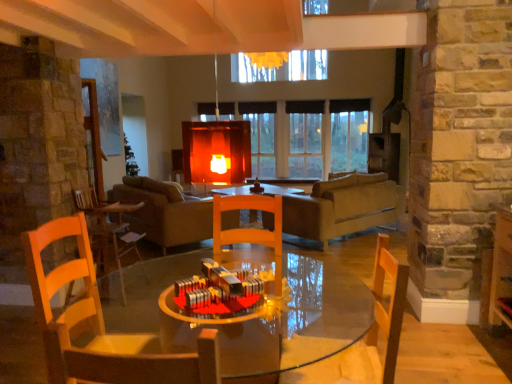
Question: Does wooden chair at center, which ranks as the second chair in right-to-left order, have a larger size compared to leather couch at center?

Choices:
 (A) no
 (B) yes

Answer: (A)

Question: Does wooden chair at center, the third chair in the back-to-front sequence, have a greater height compared to leather couch at center?

Choices:
 (A) yes
 (B) no

Answer: (B)

Question: Is wooden chair at center, positioned as the 1th chair in front-to-back order, positioned far away from leather couch at center?

Choices:
 (A) no
 (B) yes

Answer: (B)

Question: Is wooden chair at center, placed as the second chair when sorted from left to right, wider than leather couch at center?

Choices:
 (A) yes
 (B) no

Answer: (B)

Question: Is wooden chair at center, positioned as the 1th chair in front-to-back order, thinner than leather couch at center?

Choices:
 (A) no
 (B) yes

Answer: (B)

Question: Can leather couch at center be found inside wooden chair at center, which ranks as the second chair in right-to-left order?

Choices:
 (A) no
 (B) yes

Answer: (A)

Question: Is leather couch at center bigger than transparent glass window at center?

Choices:
 (A) no
 (B) yes

Answer: (B)

Question: Is leather couch at center further to camera compared to transparent glass window at center?

Choices:
 (A) no
 (B) yes

Answer: (A)

Question: From a real-world perspective, does leather couch at center stand above transparent glass window at center?

Choices:
 (A) yes
 (B) no

Answer: (B)

Question: Is leather couch at center positioned with its back to transparent glass window at center?

Choices:
 (A) no
 (B) yes

Answer: (A)

Question: From the image's perspective, is leather couch at center on top of transparent glass window at center?

Choices:
 (A) yes
 (B) no

Answer: (B)

Question: Is leather couch at center thinner than transparent glass window at center?

Choices:
 (A) yes
 (B) no

Answer: (B)

Question: From the image's perspective, is wooden chair at left, arranged as the third chair when viewed from the right, beneath transparent glass window at center?

Choices:
 (A) no
 (B) yes

Answer: (B)